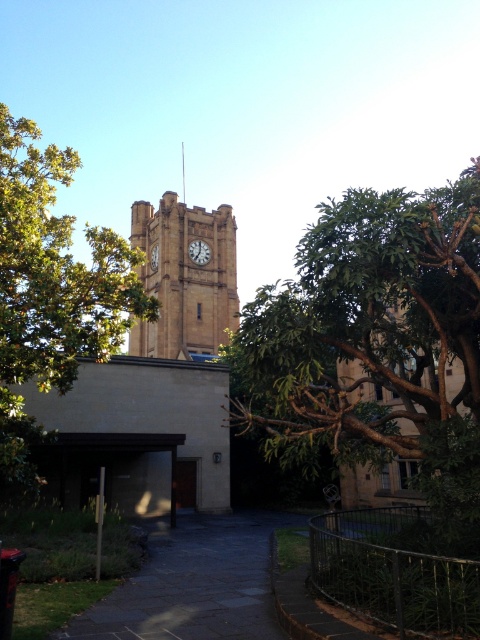
Is green leafy tree at left shorter than matte stone clock at center?

In fact, green leafy tree at left may be taller than matte stone clock at center.

Does green leafy tree at left have a larger size compared to matte stone clock at center?

Indeed, green leafy tree at left has a larger size compared to matte stone clock at center.

Between point (93, 330) and point (156, 266), which one is positioned behind?

The point (156, 266) is behind.

Find the location of a particular element. green leafy tree at left is located at coordinates (50, 291).

Does green leafy tree at center appear under matte stone clock at center?

Correct, green leafy tree at center is located below matte stone clock at center.

Is point (456, 202) less distant than point (152, 256)?

Yes.

Between point (403, 380) and point (153, 252), which one is positioned behind?

The point (153, 252) is more distant.

What are the coordinates of `green leafy tree at center` in the screenshot? It's located at (376, 344).

Is brown stone clock tower at center positioned in front of matte brown clock at center?

That is True.

What do you see at coordinates (184, 278) in the screenshot? This screenshot has width=480, height=640. I see `brown stone clock tower at center` at bounding box center [184, 278].

At what (x,y) coordinates should I click in order to perform the action: click on brown stone clock tower at center. Please return your answer as a coordinate pair (x, y). Looking at the image, I should click on (184, 278).